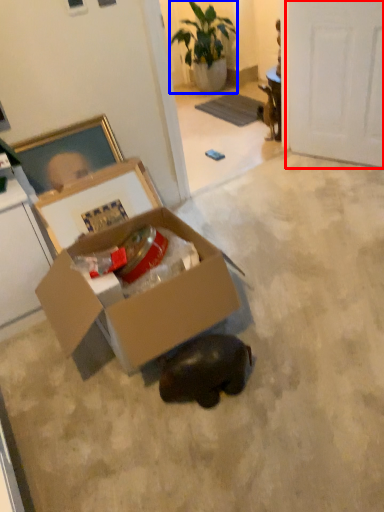
Question: Which object is closer to the camera taking this photo, door (highlighted by a red box) or houseplant (highlighted by a blue box)?

Choices:
 (A) door
 (B) houseplant

Answer: (A)